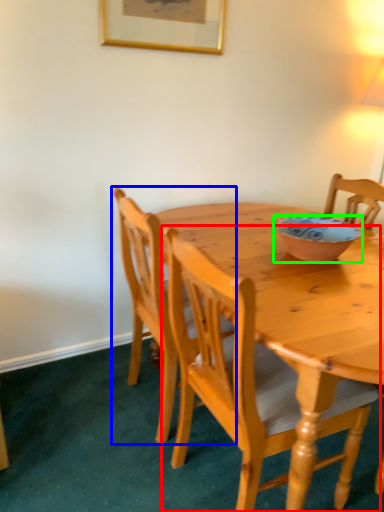
Question: Considering the real-world distances, which object is closest to chair (highlighted by a red box)? chair (highlighted by a blue box) or bowl (highlighted by a green box).

Choices:
 (A) chair
 (B) bowl

Answer: (A)